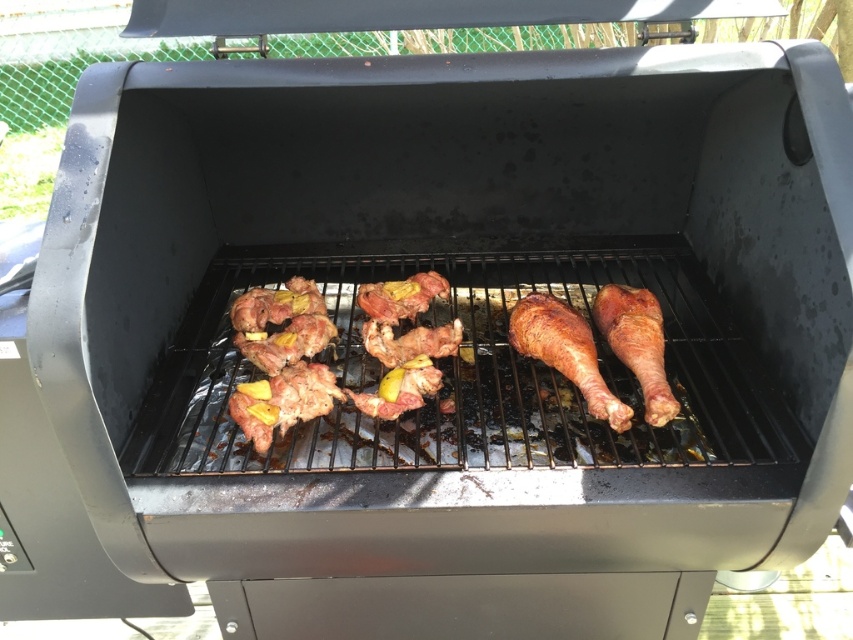
Is brown matte chicken leg at center below pinkish-brown meat at center?

Correct, brown matte chicken leg at center is located below pinkish-brown meat at center.

Can you confirm if brown matte chicken leg at center is positioned to the right of pinkish-brown meat at center?

Incorrect, brown matte chicken leg at center is not on the right side of pinkish-brown meat at center.

You are a GUI agent. You are given a task and a screenshot of the screen. Output one action in this format:
    pyautogui.click(x=<x>, y=<y>)
    Task: Click on the brown matte chicken leg at center
    This screenshot has height=640, width=853.
    Given the screenshot: What is the action you would take?
    pyautogui.click(x=399, y=388)

This screenshot has width=853, height=640. What do you see at coordinates (566, 352) in the screenshot? I see `golden brown crispy drumstick at center` at bounding box center [566, 352].

Does golden brown crispy drumstick at center have a lesser width compared to brown matte chicken leg at center?

In fact, golden brown crispy drumstick at center might be wider than brown matte chicken leg at center.

Between point (532, 300) and point (364, 410), which one is positioned behind?

Positioned behind is point (532, 300).

Identify the location of golden brown crispy drumstick at center. (566, 352).

Does smoked brown chicken leg at center appear under pinkish-brown meat at center?

Correct, smoked brown chicken leg at center is located below pinkish-brown meat at center.

Which of these two, smoked brown chicken leg at center or pinkish-brown meat at center, stands shorter?

pinkish-brown meat at center

The width and height of the screenshot is (853, 640). What do you see at coordinates (637, 342) in the screenshot?
I see `smoked brown chicken leg at center` at bounding box center [637, 342].

Where is `smoked brown chicken leg at center`? The image size is (853, 640). smoked brown chicken leg at center is located at coordinates point(637,342).